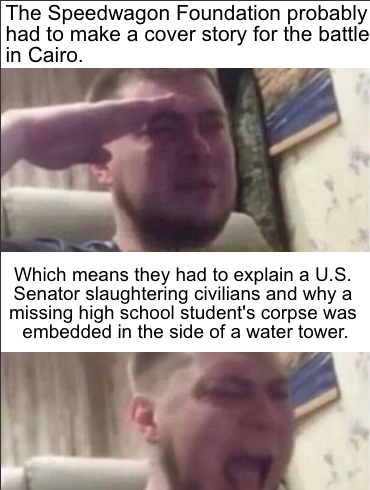
Locate an element on the screen. gray wall is located at coordinates (44, 92).